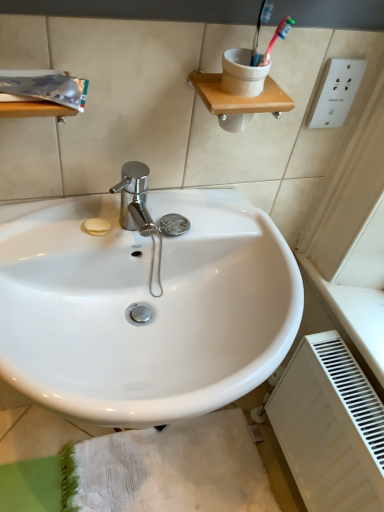
Question: Considering the relative sizes of white matte radiator at lower right and white textured bath mat at lower center in the image provided, is white matte radiator at lower right smaller than white textured bath mat at lower center?

Choices:
 (A) yes
 (B) no

Answer: (B)

Question: From the image's perspective, does white matte radiator at lower right appear higher than white textured bath mat at lower center?

Choices:
 (A) no
 (B) yes

Answer: (B)

Question: Is white matte radiator at lower right taller than white textured bath mat at lower center?

Choices:
 (A) yes
 (B) no

Answer: (A)

Question: Is white matte radiator at lower right in front of white textured bath mat at lower center?

Choices:
 (A) yes
 (B) no

Answer: (A)

Question: Is white matte radiator at lower right at the left side of white textured bath mat at lower center?

Choices:
 (A) no
 (B) yes

Answer: (A)

Question: From the image's perspective, would you say white matte radiator at lower right is shown under white textured bath mat at lower center?

Choices:
 (A) no
 (B) yes

Answer: (A)

Question: Can white glossy sink at center be found inside white textured bath mat at lower center?

Choices:
 (A) yes
 (B) no

Answer: (B)

Question: Is white textured bath mat at lower center facing towards white glossy sink at center?

Choices:
 (A) yes
 (B) no

Answer: (B)

Question: From a real-world perspective, is white textured bath mat at lower center located higher than white glossy sink at center?

Choices:
 (A) yes
 (B) no

Answer: (B)

Question: Is white textured bath mat at lower center with white glossy sink at center?

Choices:
 (A) yes
 (B) no

Answer: (B)

Question: From a real-world perspective, is white textured bath mat at lower center located beneath white glossy sink at center?

Choices:
 (A) no
 (B) yes

Answer: (B)

Question: Considering the relative positions of white textured bath mat at lower center and white glossy sink at center in the image provided, is white textured bath mat at lower center to the right of white glossy sink at center from the viewer's perspective?

Choices:
 (A) no
 (B) yes

Answer: (B)

Question: Is white glossy sink at center at the back of white matte radiator at lower right?

Choices:
 (A) yes
 (B) no

Answer: (B)